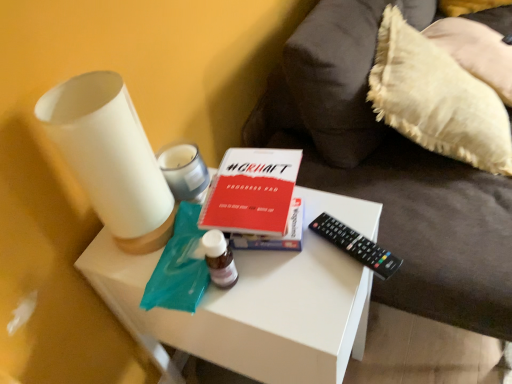
Question: From their relative heights in the image, would you say white glossy candle at upper center, marked as the first candle holder in a back-to-front arrangement, is taller or shorter than white matte vase at left, the second candle holder positioned from the back?

Choices:
 (A) short
 (B) tall

Answer: (A)

Question: Does point (179, 196) appear closer or farther from the camera than point (117, 152)?

Choices:
 (A) farther
 (B) closer

Answer: (A)

Question: Considering the real-world distances, which object is closest to the white matte side table at center?

Choices:
 (A) white matte table at center
 (B) black plastic remote at right
 (C) white fluffy pillow at right
 (D) red matte progress pad at center
 (E) white glossy candle at upper center, the 2th candle holder in the front-to-back sequence

Answer: (C)

Question: Estimate the real-world distances between objects in this image. Which object is closer to the white matte vase at left, the second candle holder positioned from the back?

Choices:
 (A) white glossy candle at upper center, marked as the first candle holder in a back-to-front arrangement
 (B) white matte table at center
 (C) white fluffy pillow at right
 (D) black plastic remote at right
 (E) red matte progress pad at center

Answer: (A)